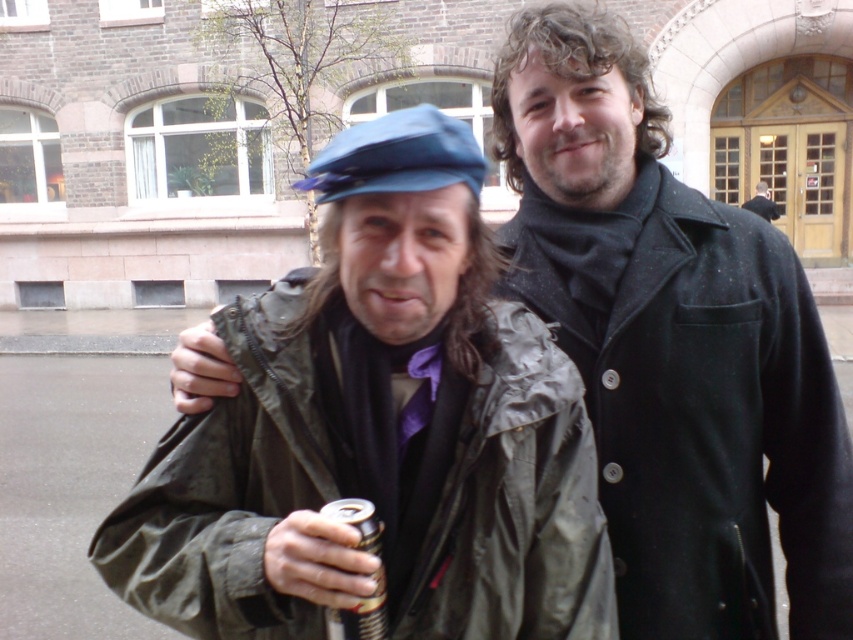
Question: Which of the following is the closest to the observer?

Choices:
 (A) olive-green fabric trench coat at center
 (B) dark gray wool coat at right

Answer: (A)

Question: Estimate the real-world distances between objects in this image. Which object is closer to the blue fabric cap at center?

Choices:
 (A) metallic can at lower center
 (B) olive-green fabric trench coat at center
 (C) dark gray wool coat at right

Answer: (B)

Question: Is olive-green fabric trench coat at center bigger than metallic can at lower center?

Choices:
 (A) yes
 (B) no

Answer: (A)

Question: In this image, where is olive-green fabric trench coat at center located relative to dark gray wool coat at right?

Choices:
 (A) right
 (B) left

Answer: (B)

Question: Which of the following is the farthest from the observer?

Choices:
 (A) blue fabric cap at center
 (B) olive-green fabric trench coat at center

Answer: (A)

Question: Does blue fabric cap at center appear under dark gray wool coat at right?

Choices:
 (A) yes
 (B) no

Answer: (A)